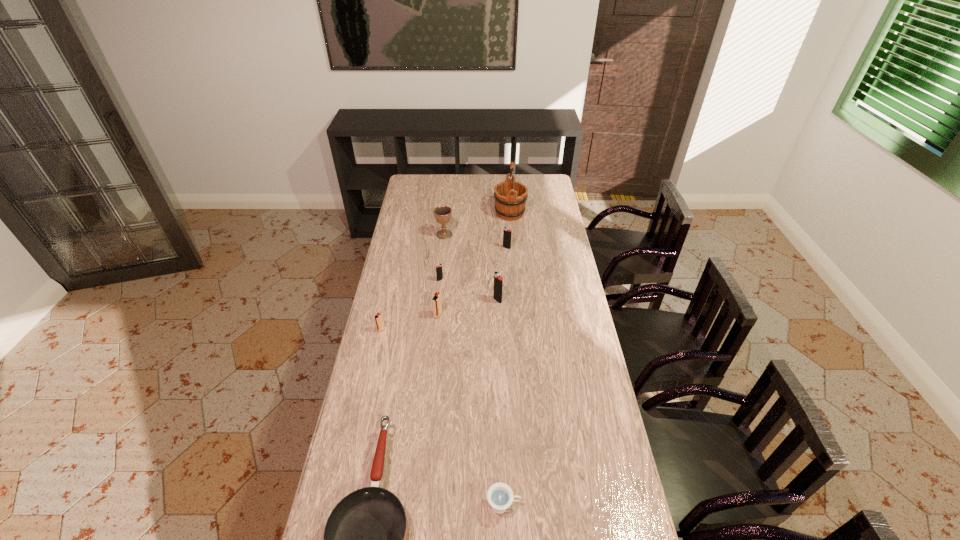
Locate an element on the screen. The width and height of the screenshot is (960, 540). free space that is in between the biggest black igniter and the leftmost black igniter is located at coordinates (468, 290).

Where is `vacant space that's between the farther red igniter and the second black igniter from left to right`? This screenshot has width=960, height=540. vacant space that's between the farther red igniter and the second black igniter from left to right is located at coordinates (468, 307).

Image resolution: width=960 pixels, height=540 pixels. I want to click on free space between the biggest black igniter and the farthest black igniter, so click(x=502, y=274).

Where is `free point between the shortest object and the brown chalice`? The height and width of the screenshot is (540, 960). free point between the shortest object and the brown chalice is located at coordinates (474, 370).

Find the location of a particular element. The width and height of the screenshot is (960, 540). vacant region between the teacup and the farthest object is located at coordinates (507, 359).

Find the location of `object that stands as the fourth closest to the second nearest black igniter`. object that stands as the fourth closest to the second nearest black igniter is located at coordinates (379, 322).

Locate an element on the screen. Image resolution: width=960 pixels, height=540 pixels. object that ranks as the fifth closest to the pan is located at coordinates (439, 274).

Identify which igniter is located as the third nearest to the second farthest black igniter. Please provide its 2D coordinates. Your answer should be formatted as a tuple, i.e. [(x, y)], where the tuple contains the x and y coordinates of a point satisfying the conditions above.

[(379, 322)]

Choose which igniter is the third nearest neighbor to the brown pan. Please provide its 2D coordinates. Your answer should be formatted as a tuple, i.e. [(x, y)], where the tuple contains the x and y coordinates of a point satisfying the conditions above.

[(498, 280)]

Identify which black igniter is located as the nearest to the brown pan. Please provide its 2D coordinates. Your answer should be formatted as a tuple, i.e. [(x, y)], where the tuple contains the x and y coordinates of a point satisfying the conditions above.

[(498, 280)]